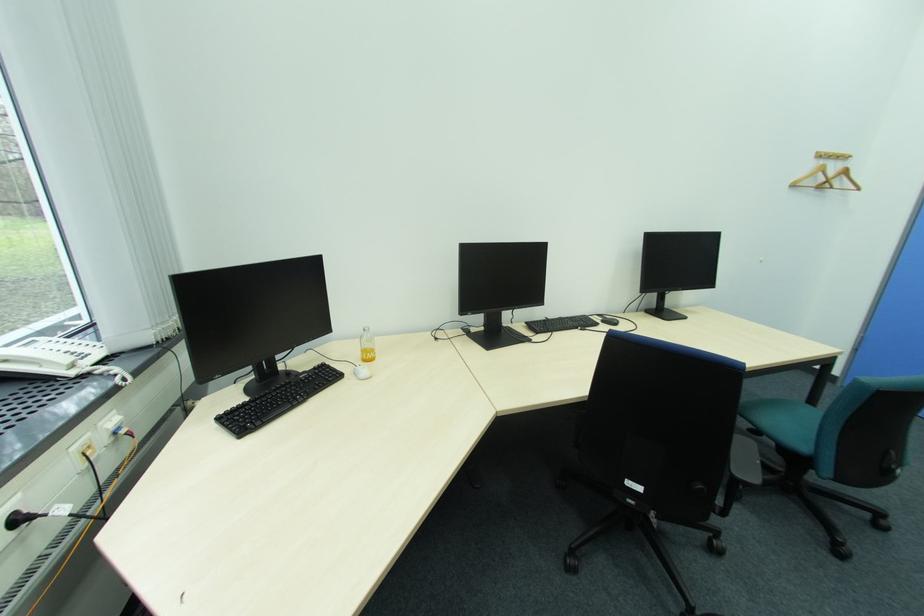
The width and height of the screenshot is (924, 616). I want to click on bottle cap, so click(366, 329).